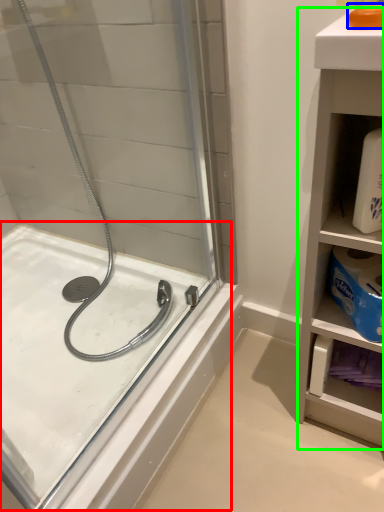
Question: Which is nearer to the bath (highlighted by a red box)? soap (highlighted by a blue box) or bathroom cabinet (highlighted by a green box).

Choices:
 (A) soap
 (B) bathroom cabinet

Answer: (B)